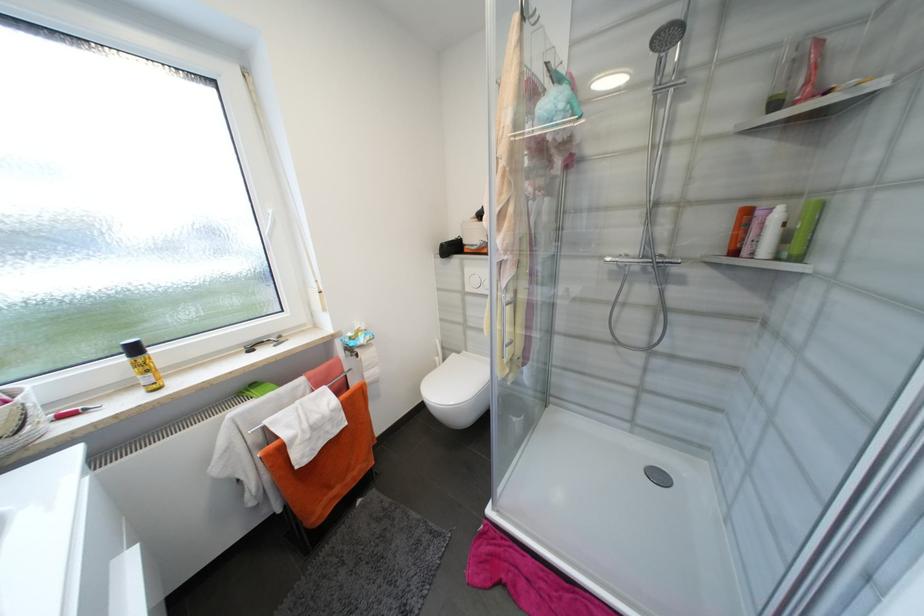
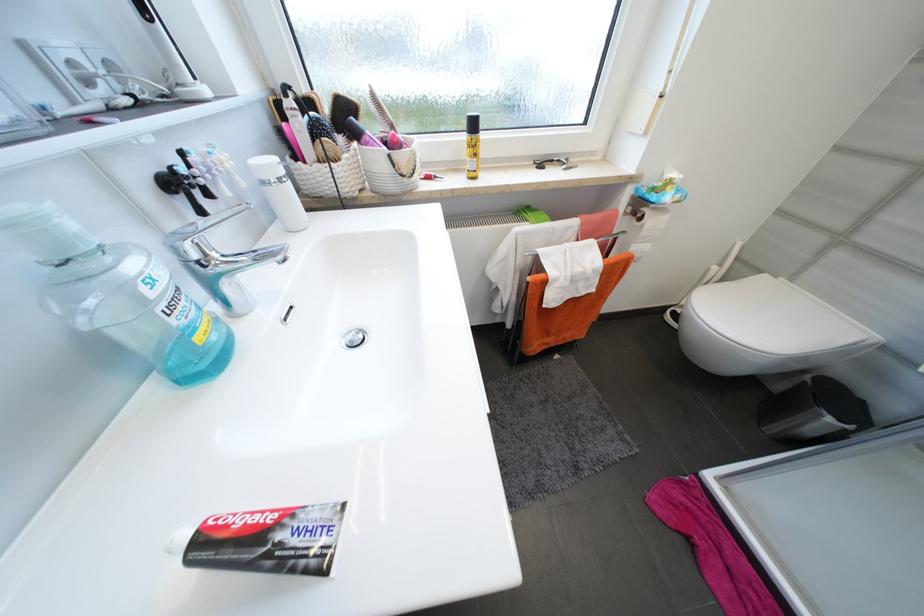
Based on the continuous images, in which direction is the camera rotating?

The camera rotated toward left-down.